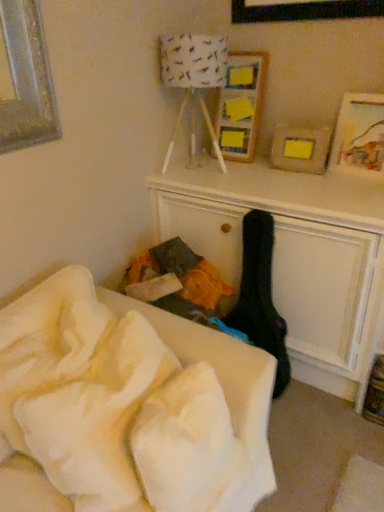
Identify the location of empty space that is ontop of wooden picture frame at upper center, placed as the second picture frame when sorted from right to left (from a real-world perspective). This screenshot has height=512, width=384. pyautogui.click(x=252, y=41).